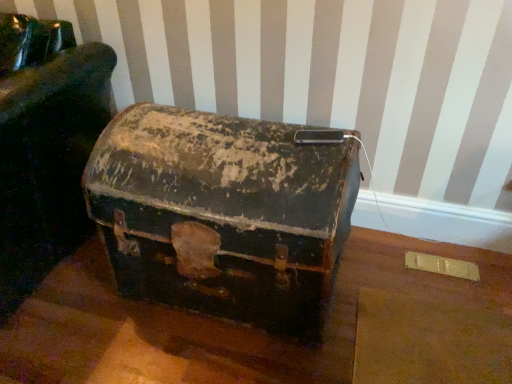
Find the location of `rusty metal suitcase at center`. rusty metal suitcase at center is located at coordinates (223, 215).

This screenshot has height=384, width=512. Describe the element at coordinates (223, 215) in the screenshot. I see `rusty metal suitcase at center` at that location.

Where is `rusty metal suitcase at center`? rusty metal suitcase at center is located at coordinates (223, 215).